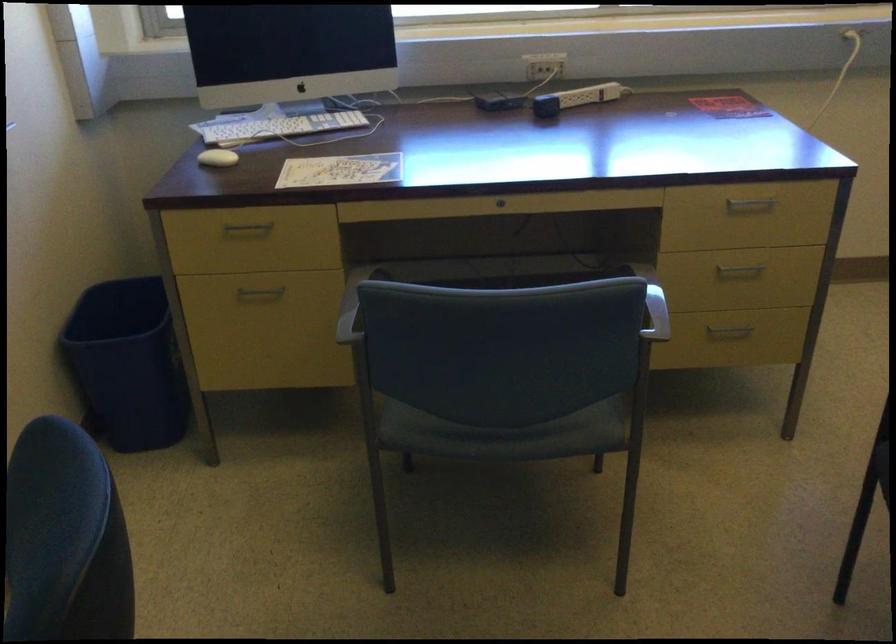
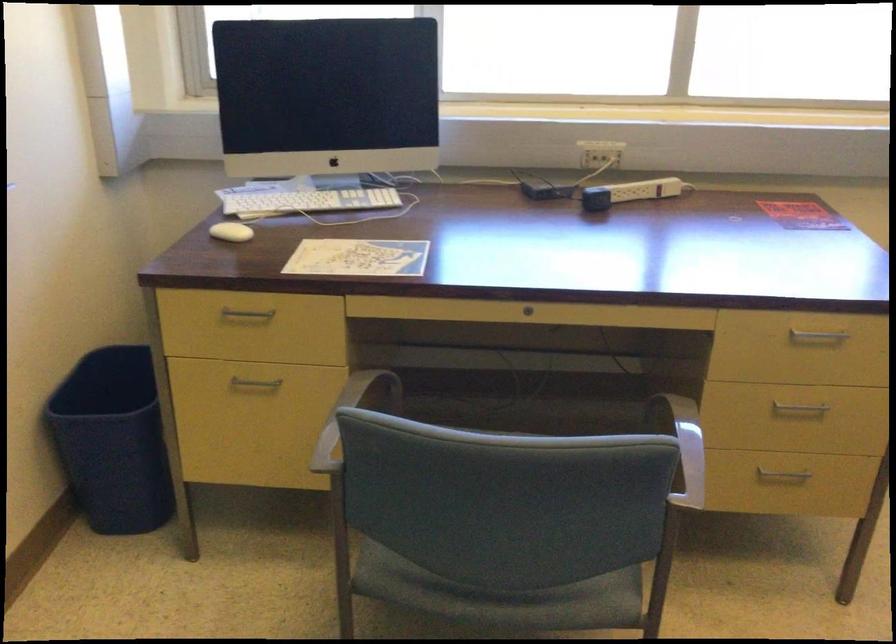
In the second image, find the point that corresponds to pixel 751 203 in the first image.

(816, 336)